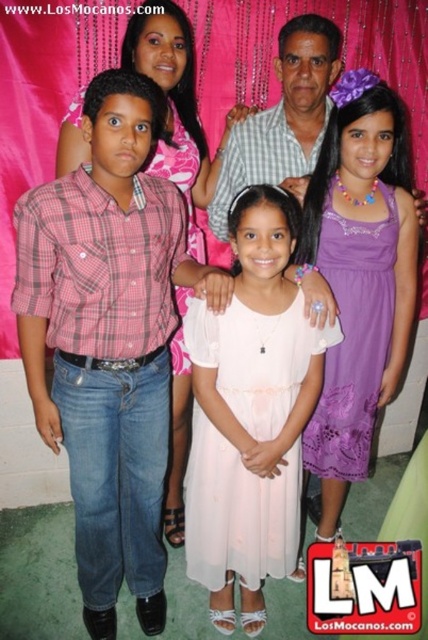
Is pink sheer dress at center closer to camera compared to checkered fabric shirt at center?

Yes, pink sheer dress at center is in front of checkered fabric shirt at center.

Between pink sheer dress at center and checkered fabric shirt at center, which one appears on the right side from the viewer's perspective?

checkered fabric shirt at center

Find the location of a particular element. This screenshot has height=640, width=428. pink sheer dress at center is located at coordinates (250, 413).

Between point (321, 186) and point (269, 115), which one is positioned in front?

Point (321, 186) is in front.

Can you confirm if purple lace dress at center is taller than checkered fabric shirt at center?

Yes.

Find the location of `purple lace dress at center`. purple lace dress at center is located at coordinates (359, 276).

Is pink sheer dress at center above purple lace dress at center?

Actually, pink sheer dress at center is below purple lace dress at center.

Between pink sheer dress at center and purple lace dress at center, which one appears on the right side from the viewer's perspective?

Positioned to the right is purple lace dress at center.

The width and height of the screenshot is (428, 640). Describe the element at coordinates (250, 413) in the screenshot. I see `pink sheer dress at center` at that location.

You are a GUI agent. You are given a task and a screenshot of the screen. Output one action in this format:
    pyautogui.click(x=<x>, y=<y>)
    Task: Click on the pink sheer dress at center
    This screenshot has width=428, height=640.
    Given the screenshot: What is the action you would take?
    pyautogui.click(x=250, y=413)